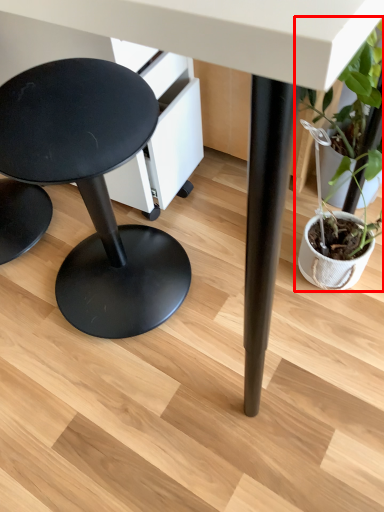
Question: From the image's perspective, where is houseplant (annotated by the red box) located in relation to stool in the image?

Choices:
 (A) above
 (B) below

Answer: (A)